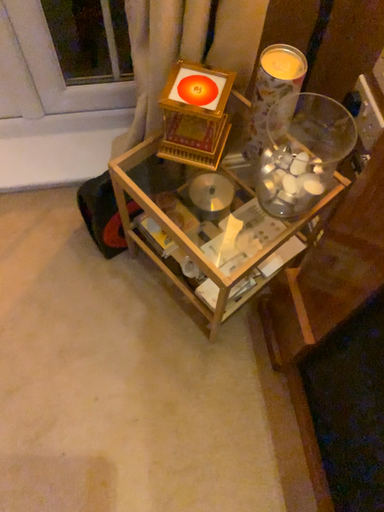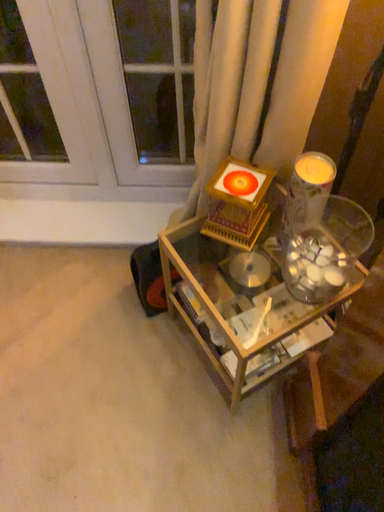
Question: How did the camera likely rotate when shooting the video?

Choices:
 (A) rotated downward
 (B) rotated upward

Answer: (B)